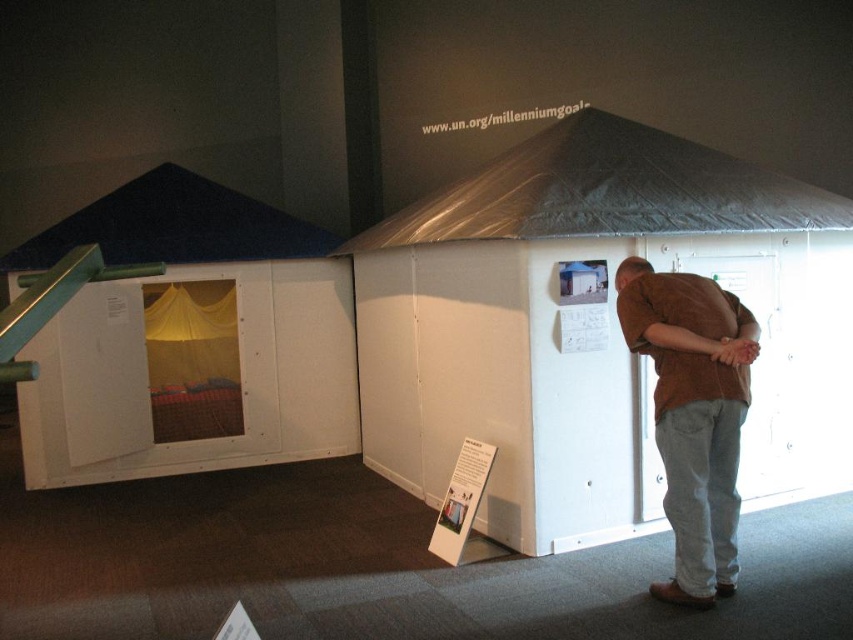
Who is positioned more to the left, transparent plastic canopy at upper center or dark blue fabric canopy at upper left?

From the viewer's perspective, dark blue fabric canopy at upper left appears more on the left side.

Which is behind, point (767, 202) or point (292, 253)?

Point (292, 253)

Find the location of a particular element. transparent plastic canopy at upper center is located at coordinates (607, 192).

In the scene shown: Is white matte tent at left shorter than brown cotton shirt at center?

Incorrect, white matte tent at left's height does not fall short of brown cotton shirt at center's.

Which of these two, white matte tent at left or brown cotton shirt at center, stands taller?

Standing taller between the two is white matte tent at left.

Is point (345, 349) less distant than point (691, 340)?

No, it is behind (691, 340).

Locate an element on the screen. This screenshot has width=853, height=640. white matte tent at left is located at coordinates (189, 342).

Can you confirm if white matte tent at center is positioned to the right of brown cotton shirt at center?

In fact, white matte tent at center is to the left of brown cotton shirt at center.

From the picture: Which is above, white matte tent at center or brown cotton shirt at center?

white matte tent at center is above.

Is point (840, 218) farther from camera compared to point (724, 540)?

Yes, it is behind point (724, 540).

You are a GUI agent. You are given a task and a screenshot of the screen. Output one action in this format:
    pyautogui.click(x=<x>, y=<y>)
    Task: Click on the white matte tent at center
    
    Given the screenshot: What is the action you would take?
    pyautogui.click(x=595, y=328)